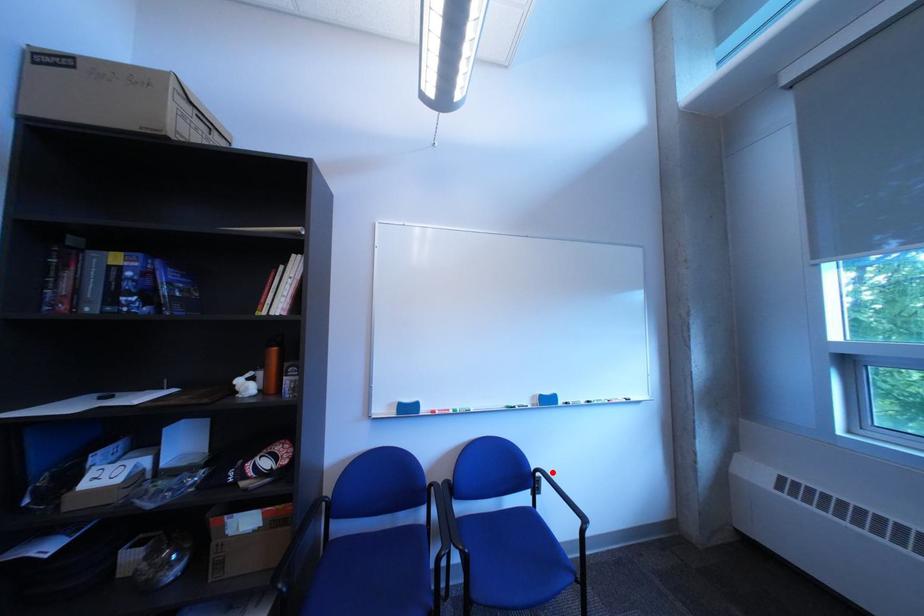
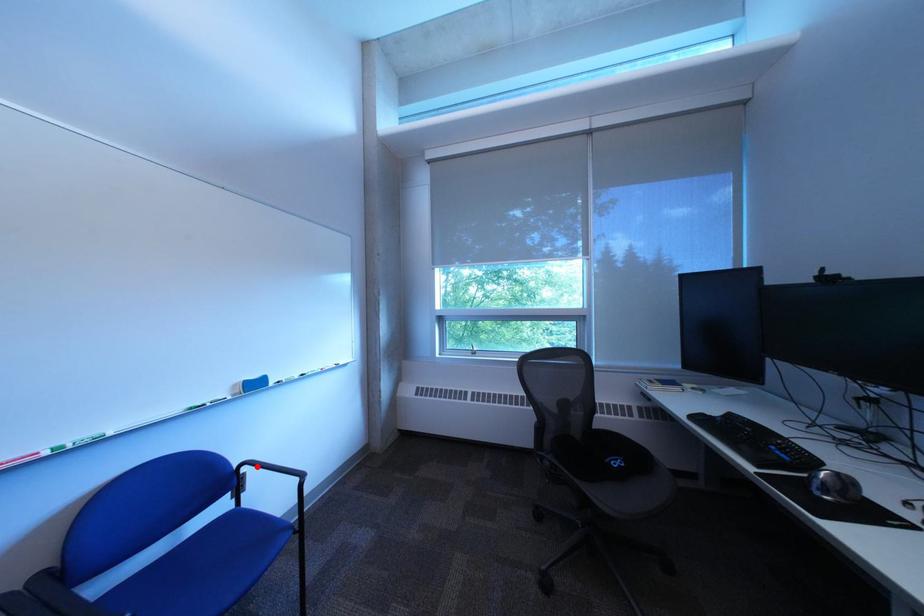
I am providing you with two images of the same scene from different viewpoints. A red point is marked on the first image and another point is marked on the second image. Does the point marked in image1 correspond to the same location as the one in image2?

Yes